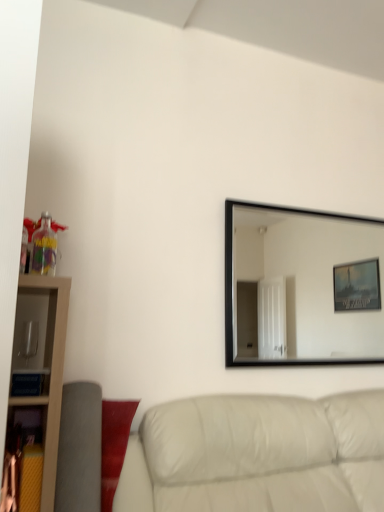
Question: Is black frame mirror at upper right thinner than white leather couch at lower right?

Choices:
 (A) no
 (B) yes

Answer: (B)

Question: From the image's perspective, is black frame mirror at upper right located beneath white leather couch at lower right?

Choices:
 (A) yes
 (B) no

Answer: (B)

Question: Would you consider black frame mirror at upper right to be distant from white leather couch at lower right?

Choices:
 (A) no
 (B) yes

Answer: (B)

Question: Does black frame mirror at upper right appear on the left side of white leather couch at lower right?

Choices:
 (A) no
 (B) yes

Answer: (A)

Question: From a real-world perspective, is black frame mirror at upper right physically below white leather couch at lower right?

Choices:
 (A) yes
 (B) no

Answer: (B)

Question: Considering the relative sizes of black frame mirror at upper right and white leather couch at lower right in the image provided, is black frame mirror at upper right smaller than white leather couch at lower right?

Choices:
 (A) no
 (B) yes

Answer: (B)

Question: Does white leather couch at lower right have a greater width compared to black frame mirror at upper right?

Choices:
 (A) yes
 (B) no

Answer: (A)

Question: Is white leather couch at lower right to the left of black frame mirror at upper right from the viewer's perspective?

Choices:
 (A) yes
 (B) no

Answer: (A)

Question: Considering the relative sizes of white leather couch at lower right and black frame mirror at upper right in the image provided, is white leather couch at lower right thinner than black frame mirror at upper right?

Choices:
 (A) no
 (B) yes

Answer: (A)

Question: Is white leather couch at lower right directly adjacent to black frame mirror at upper right?

Choices:
 (A) yes
 (B) no

Answer: (B)

Question: Does white leather couch at lower right appear on the right side of black frame mirror at upper right?

Choices:
 (A) no
 (B) yes

Answer: (A)

Question: From a real-world perspective, does white leather couch at lower right sit lower than black frame mirror at upper right?

Choices:
 (A) no
 (B) yes

Answer: (B)

Question: Is black frame mirror at upper right situated inside white leather couch at lower right or outside?

Choices:
 (A) inside
 (B) outside

Answer: (B)